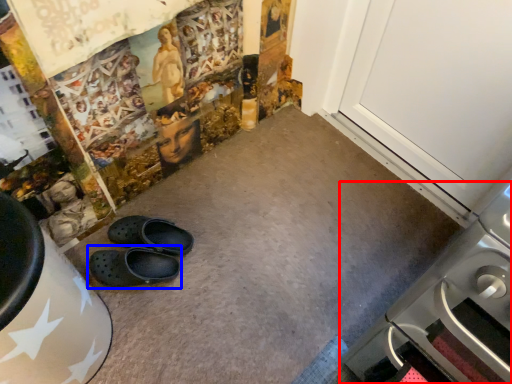
Question: Among these objects, which one is nearest to the camera, home appliance (highlighted by a red box) or footwear (highlighted by a blue box)?

Choices:
 (A) home appliance
 (B) footwear

Answer: (A)